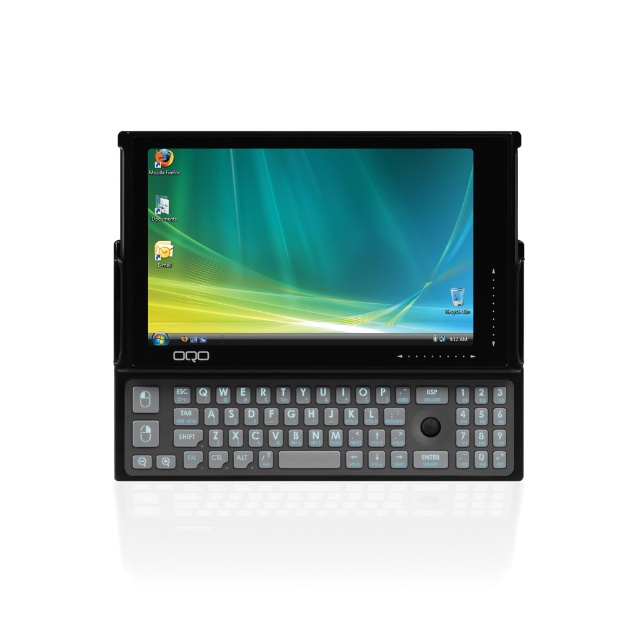
Which of these two, black plastic tablet at center or shiny plastic screen at center, stands shorter?

shiny plastic screen at center

Between point (508, 220) and point (390, 275), which one is positioned behind?

Positioned behind is point (390, 275).

Does point (428, 208) come closer to viewer compared to point (454, 216)?

No, (428, 208) is behind (454, 216).

Locate an element on the screen. The width and height of the screenshot is (640, 640). black plastic tablet at center is located at coordinates (317, 305).